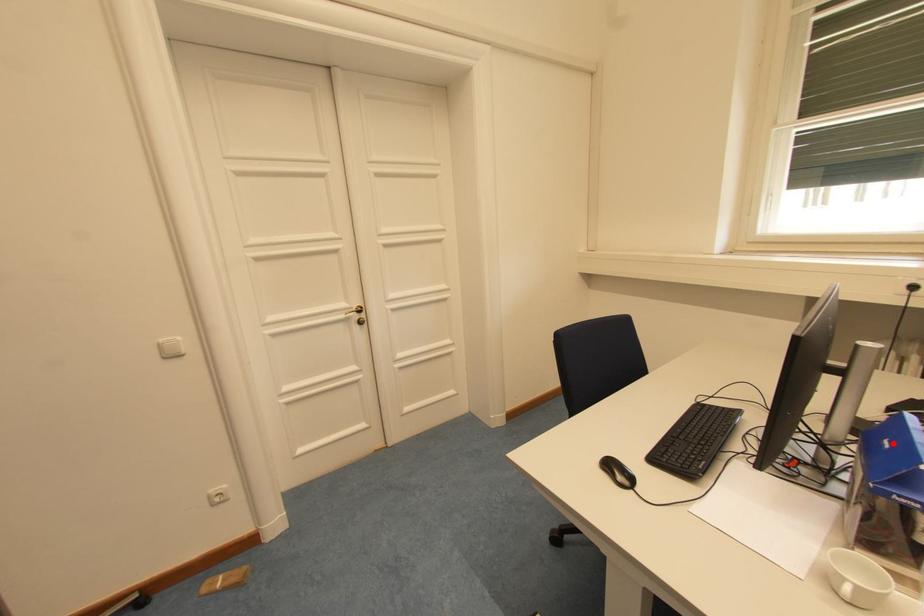
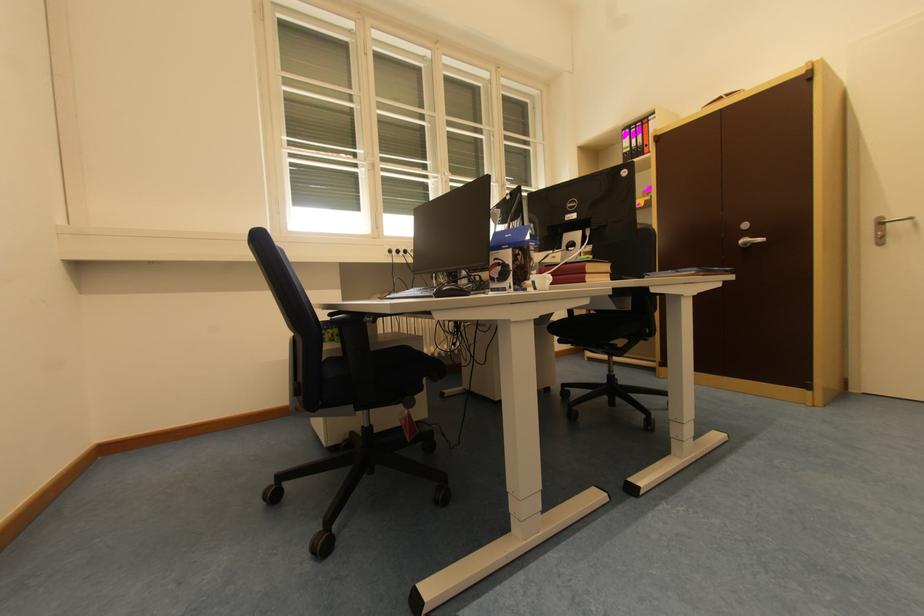
Question: I am providing you with two images of the same scene from different viewpoints. A red point is shown in image1. For the corresponding object point in image2, is it positioned nearer or farther from the camera?

Choices:
 (A) Nearer
 (B) Farther

Answer: (B)